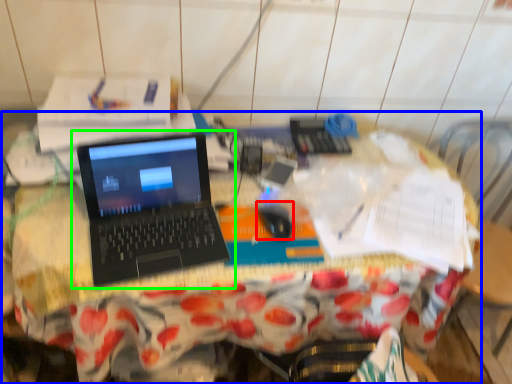
Question: Estimate the real-world distances between objects in this image. Which object is closer to mouse (highlighted by a red box), desk (highlighted by a blue box) or laptop (highlighted by a green box)?

Choices:
 (A) desk
 (B) laptop

Answer: (B)